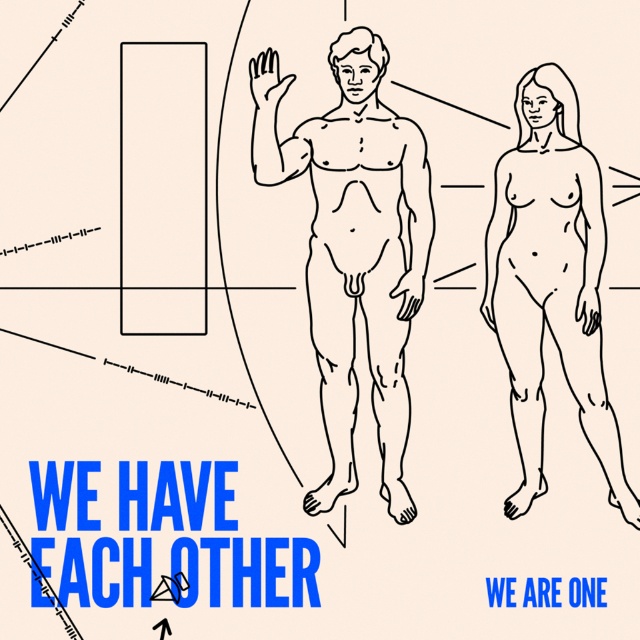
Can you confirm if black line drawing of man at center is smaller than smooth skin figure at right?

No.

Is point (355, 102) positioned in front of point (579, 404)?

Yes, it is in front of point (579, 404).

Is point (333, 285) closer to camera compared to point (500, 230)?

Yes, it is.

You are a GUI agent. You are given a task and a screenshot of the screen. Output one action in this format:
    pyautogui.click(x=<x>, y=<y>)
    Task: Click on the black line drawing of man at center
    
    Given the screenshot: What is the action you would take?
    pyautogui.click(x=355, y=250)